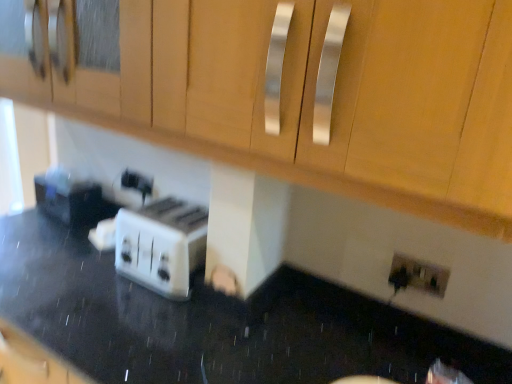
Question: From the image's perspective, is white glossy toaster at lower left above or below matte wood cabinet at upper center?

Choices:
 (A) above
 (B) below

Answer: (B)

Question: From their relative heights in the image, would you say white glossy toaster at lower left is taller or shorter than matte wood cabinet at upper center?

Choices:
 (A) tall
 (B) short

Answer: (A)

Question: Which of these objects is positioned closest to the white plastic toaster at center?

Choices:
 (A) white glossy toaster at lower left
 (B) matte wood cabinet at upper center
 (C) white plastic toaster at center
 (D) white plastic electric outlet at lower right

Answer: (C)

Question: Estimate the real-world distances between objects in this image. Which object is farther from the matte wood cabinet at upper center?

Choices:
 (A) white plastic electric outlet at lower right
 (B) white plastic toaster at center
 (C) white plastic toaster at center
 (D) white glossy toaster at lower left

Answer: (B)